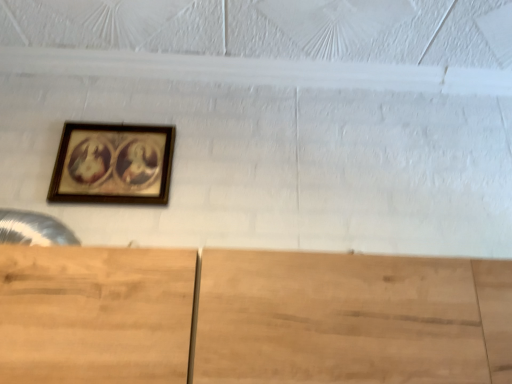
Question: Should I look upward or downward to see wooden framed portrait at left?

Choices:
 (A) up
 (B) down

Answer: (A)